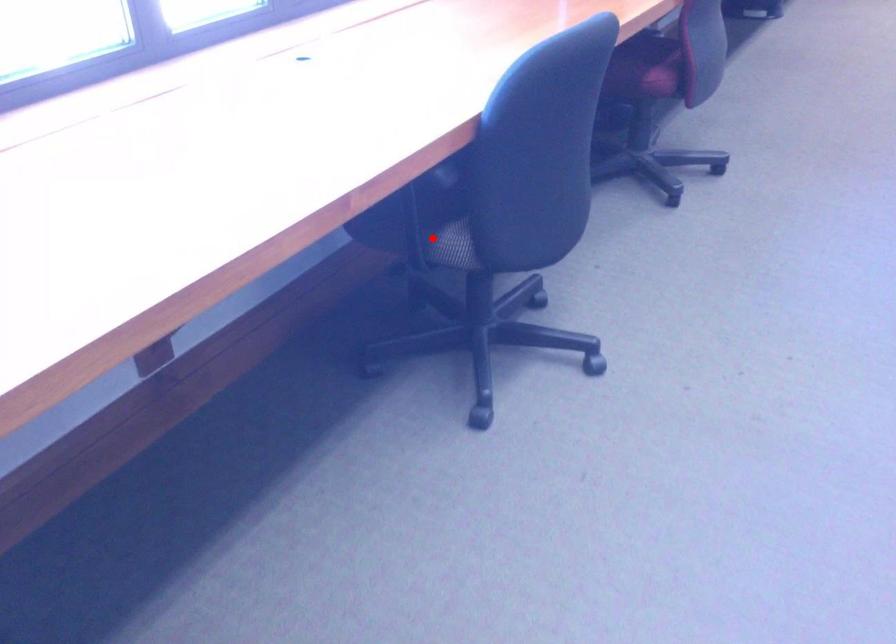
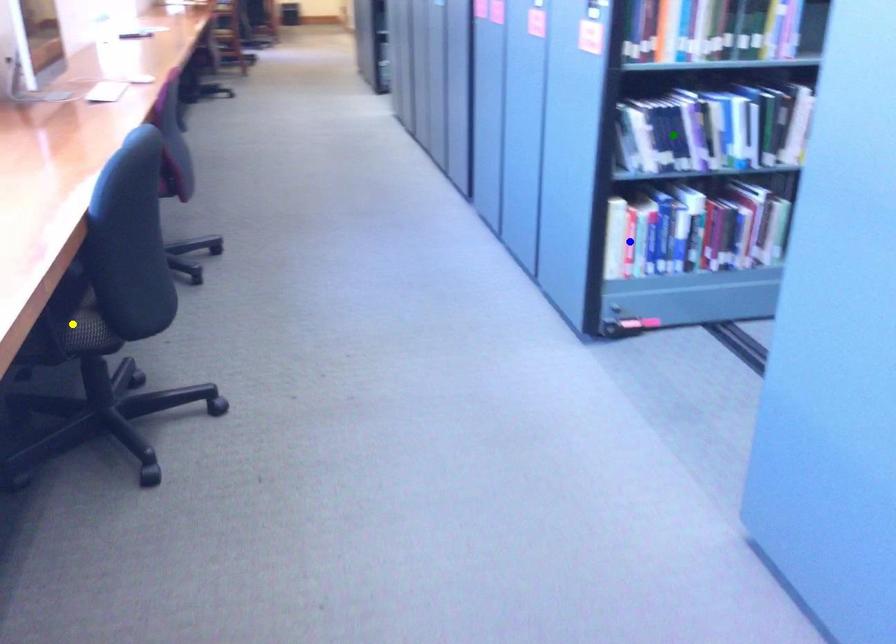
Question: I am providing you with two images of the same scene from different viewpoints. A red point is marked on the first image. You are given multiple points on the second image. Can you choose the point in image 2 that corresponds to the point in image 1?

Choices:
 (A) blue point
 (B) green point
 (C) yellow point

Answer: (C)